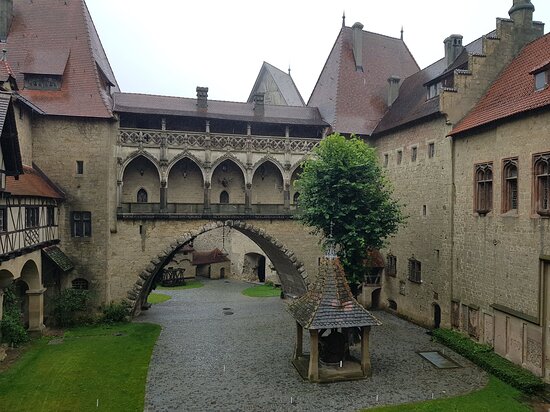
Image resolution: width=550 pixels, height=412 pixels. I want to click on chimney, so click(x=362, y=36).